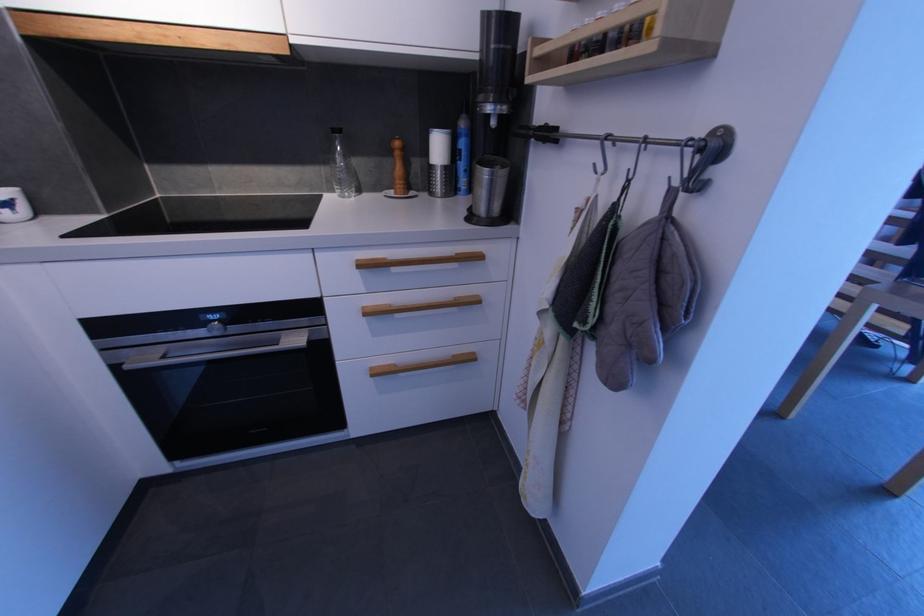
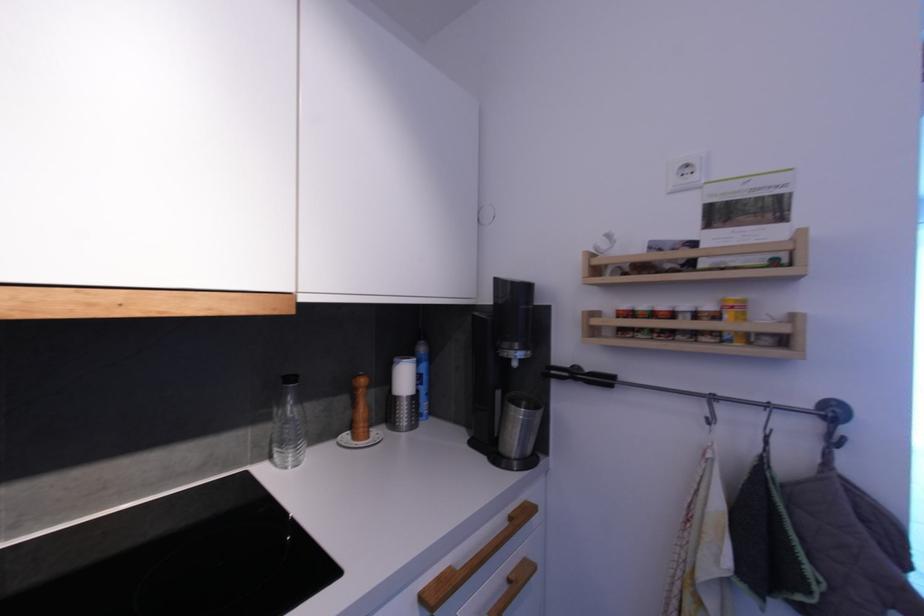
Question: I am providing you with two images of the same scene from different viewpoints. Please identify which objects are invisible in image2.

Choices:
 (A) spray can nozzle
 (B) small spice jar
 (C) wooden drawer handle
 (D) none of these

Answer: (D)